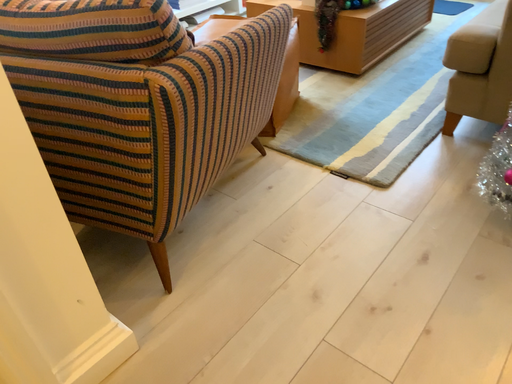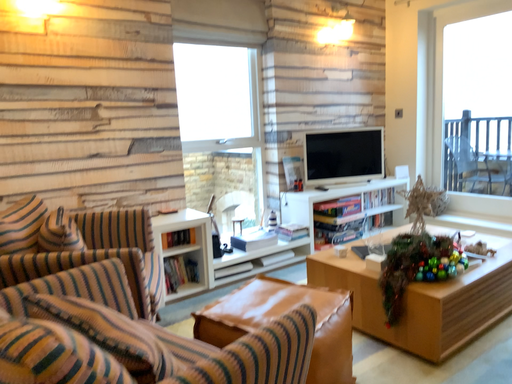
Question: How did the camera likely rotate when shooting the video?

Choices:
 (A) rotated right
 (B) rotated left

Answer: (B)